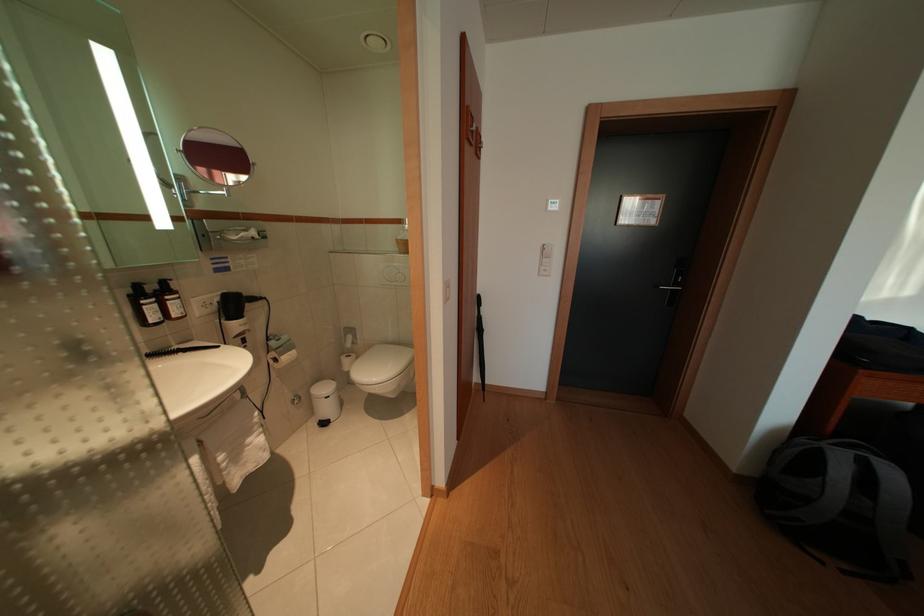
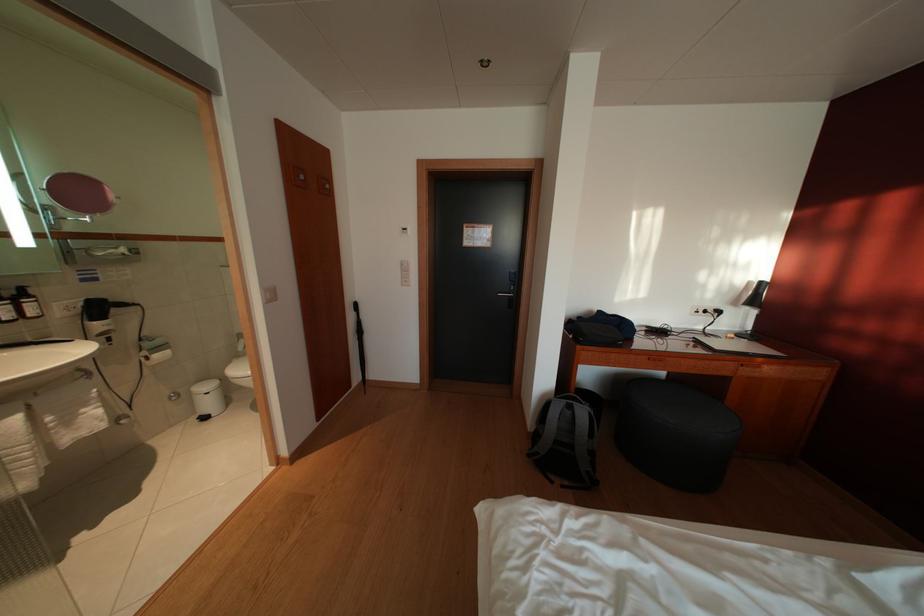
The images are taken continuously from a first-person perspective. In which direction are you moving?

The cameraman walked toward right, backward.